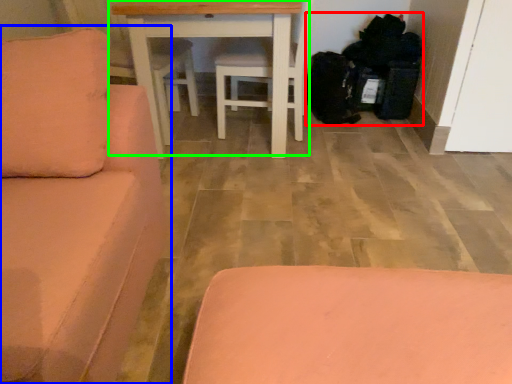
Question: Which object is positioned farthest from garbage (highlighted by a red box)? Select from studio couch (highlighted by a blue box) and table (highlighted by a green box).

Choices:
 (A) studio couch
 (B) table

Answer: (A)